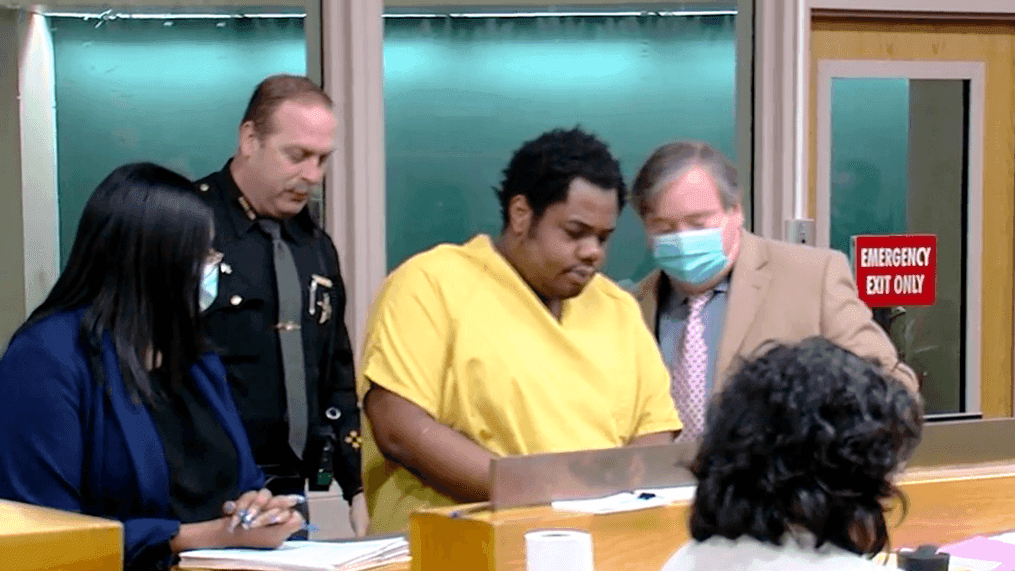
I want to click on paper towels, so click(x=567, y=546).